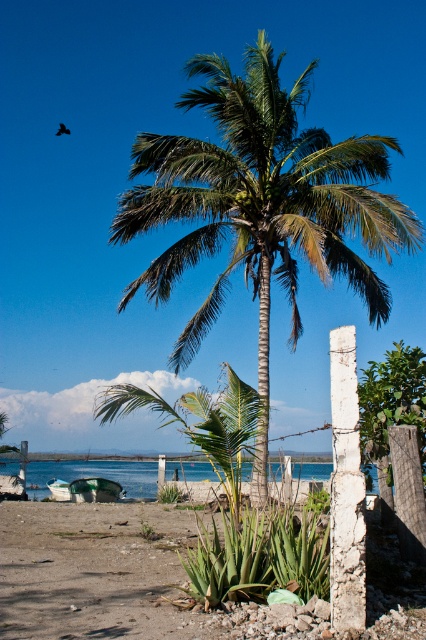
Question: Is brown sandy soil at lower center smaller than white plastic boat at lower left?

Choices:
 (A) no
 (B) yes

Answer: (A)

Question: Is brown sandy soil at lower center further to the viewer compared to white plastic boat at lower left?

Choices:
 (A) yes
 (B) no

Answer: (B)

Question: Does blue water at lower center appear on the left side of white plastic boat at lower left?

Choices:
 (A) no
 (B) yes

Answer: (A)

Question: Which of the following is the farthest from the observer?

Choices:
 (A) brown sandy soil at lower center
 (B) white plastic boat at lower left

Answer: (B)

Question: Estimate the real-world distances between objects in this image. Which object is closer to the blue water at lower center?

Choices:
 (A) green leafy coconut tree at center
 (B) brown sandy soil at lower center
 (C) white plastic boat at lower left

Answer: (A)

Question: Based on their relative distances, which object is nearer to the brown sandy soil at lower center?

Choices:
 (A) green leafy coconut tree at center
 (B) blue water at lower center
 (C) white plastic boat at lower left

Answer: (A)